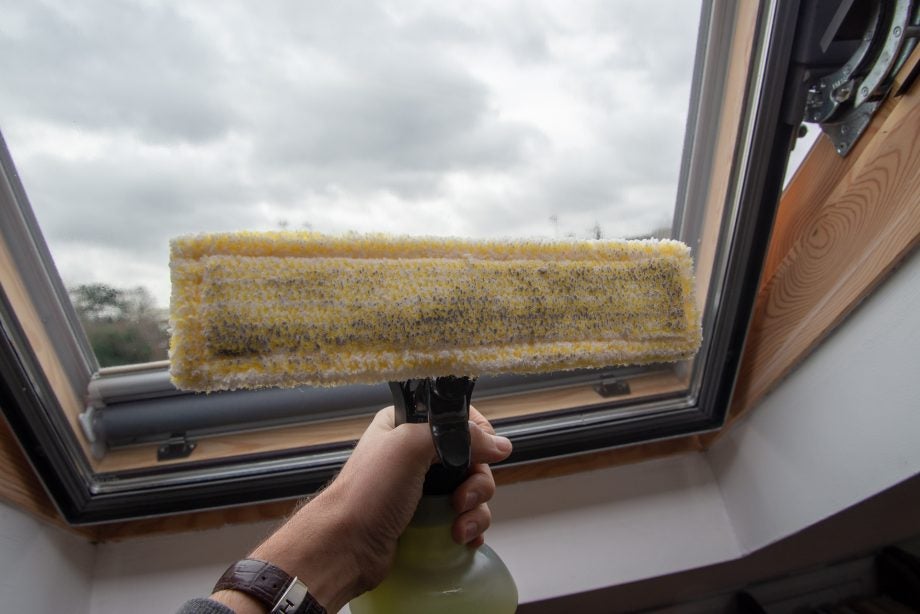
The height and width of the screenshot is (614, 920). I want to click on wall, so click(828, 470), click(652, 505), click(30, 568).